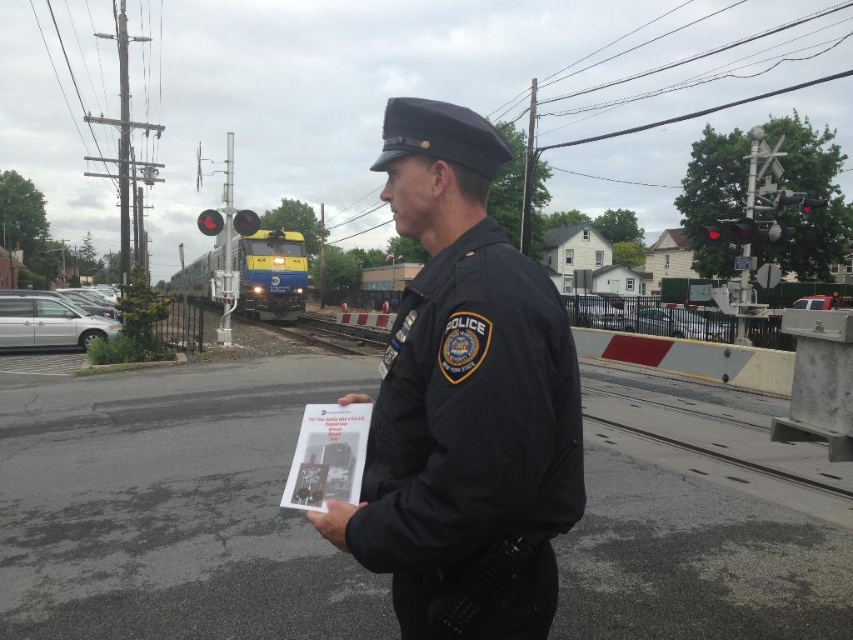
You are a delivery driver who needs to pass through the railroad crossing. You have a package that requires a minimum clearance of 1.2 meters. Can you determine if the white paper at center can fit through the space between the smooth concrete train track at center and the barrier?

The smooth concrete train track at center is wider than the white paper at center. Since the track is wider, the space between them may be sufficient for the white paper at center to pass through. However, the exact clearance isn

You are a pedestrian standing at the railroad crossing and want to cross the tracks safely. The smooth concrete train track at center is in your path. Given that you can walk at a speed of 1.5 meters per second, how many seconds do you have before the approaching train reaches the crossing?

The smooth concrete train track at center is 5.81 meters away from the camera. Since the train is approaching the crossing, you need to calculate the time it takes for the train to cover this distance. However, the train speed isn not provided in the scene description. Without knowing the train speed, it is impossible to determine the exact time available to cross safely.